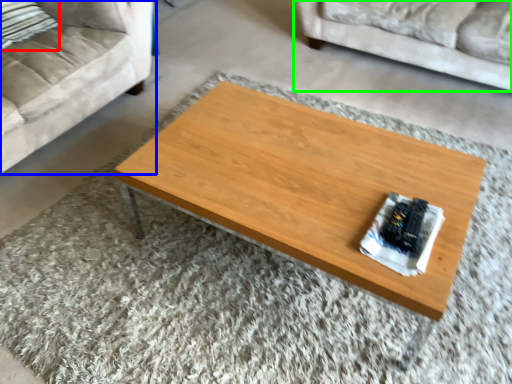
Question: Which is farther away from pillow (highlighted by a red box)? studio couch (highlighted by a blue box) or studio couch (highlighted by a green box)?

Choices:
 (A) studio couch
 (B) studio couch

Answer: (B)